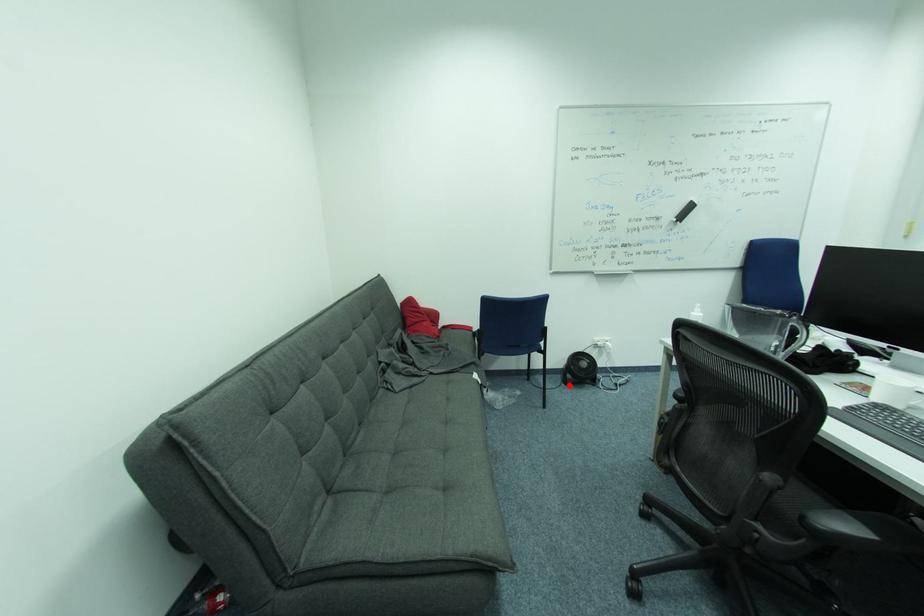
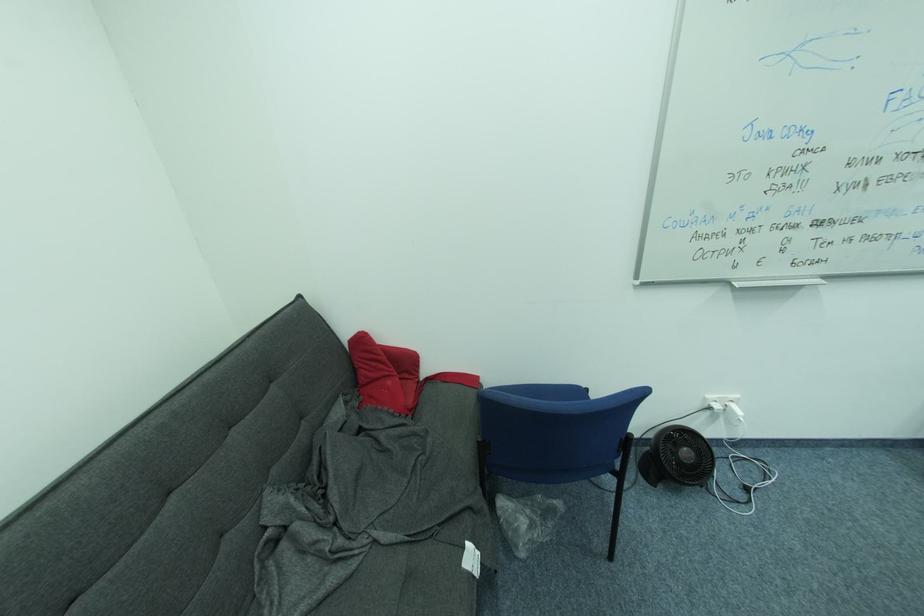
Locate, in the second image, the point that corresponds to the highlighted location in the first image.

(648, 479)